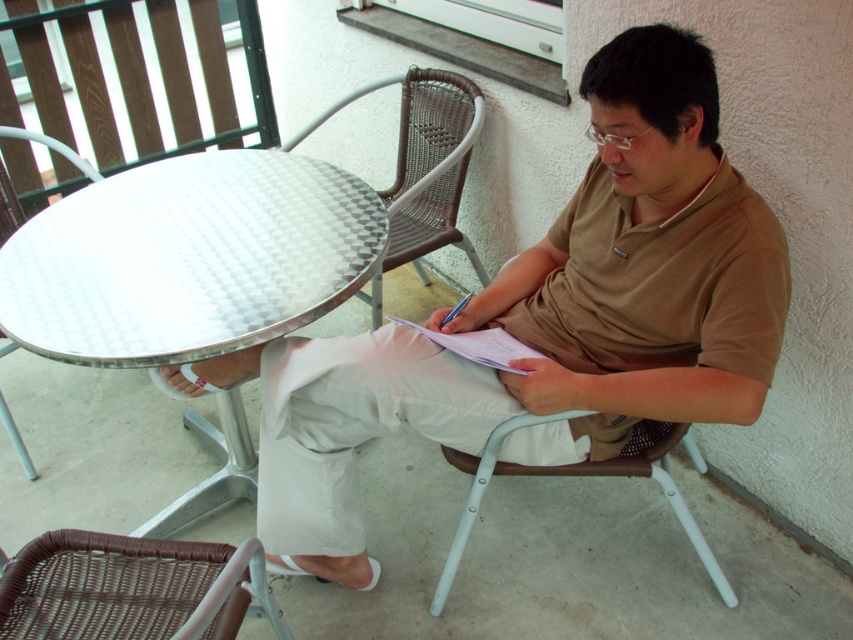
Question: Which object appears farthest from the camera in this image?

Choices:
 (A) metallic white table at left
 (B) matte brown shirt at center
 (C) metallic silver table at center
 (D) brown wicker chair at lower left

Answer: (A)

Question: Among these points, which one is farthest from the camera?

Choices:
 (A) (128, 337)
 (B) (444, 99)
 (C) (93, 177)

Answer: (B)

Question: Which object is the closest to the matte brown shirt at center?

Choices:
 (A) metallic white table at left
 (B) metallic silver table at center
 (C) white plastic chair at lower center

Answer: (C)

Question: Is matte brown shirt at center to the left of metallic silver table at center from the viewer's perspective?

Choices:
 (A) no
 (B) yes

Answer: (A)

Question: Is the position of matte brown shirt at center more distant than that of metallic silver table at center?

Choices:
 (A) yes
 (B) no

Answer: (B)

Question: Does matte brown shirt at center appear over white plastic chair at lower center?

Choices:
 (A) yes
 (B) no

Answer: (A)